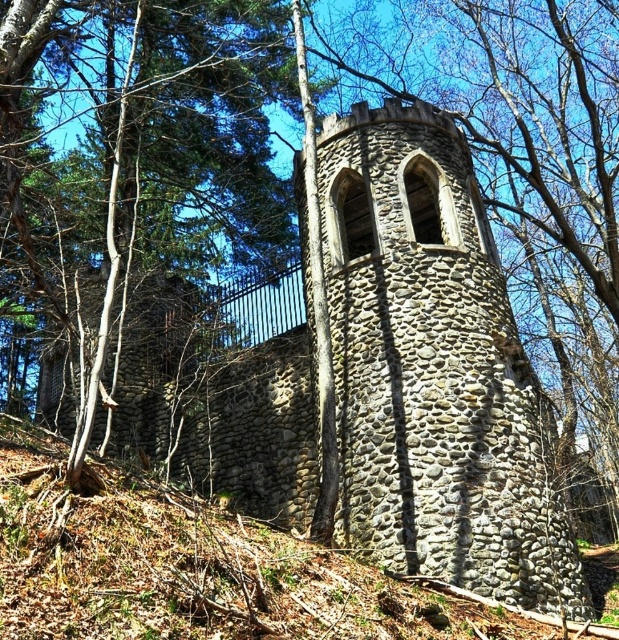
Question: Can you confirm if stone tower at center is bigger than gray stone wall at center?

Choices:
 (A) no
 (B) yes

Answer: (B)

Question: Which of the following is the closest to the observer?

Choices:
 (A) (297, 612)
 (B) (496, 380)

Answer: (A)

Question: Is stone tower at center wider than gray stone wall at center?

Choices:
 (A) no
 (B) yes

Answer: (B)

Question: Among these points, which one is nearest to the camera?

Choices:
 (A) pyautogui.click(x=264, y=412)
 (B) pyautogui.click(x=128, y=634)

Answer: (B)

Question: Does stone tower at center appear under gray stone wall at center?

Choices:
 (A) yes
 (B) no

Answer: (B)

Question: Which object appears farthest from the camera in this image?

Choices:
 (A) stone tower at center
 (B) gray stone wall at center

Answer: (A)